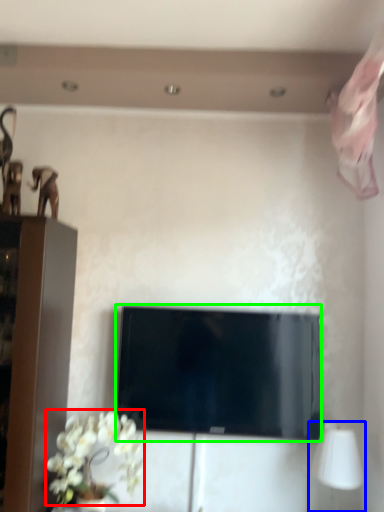
Question: Considering the real-world distances, which object is farthest from flower (highlighted by a red box)? table lamp (highlighted by a blue box) or television (highlighted by a green box)?

Choices:
 (A) table lamp
 (B) television

Answer: (A)